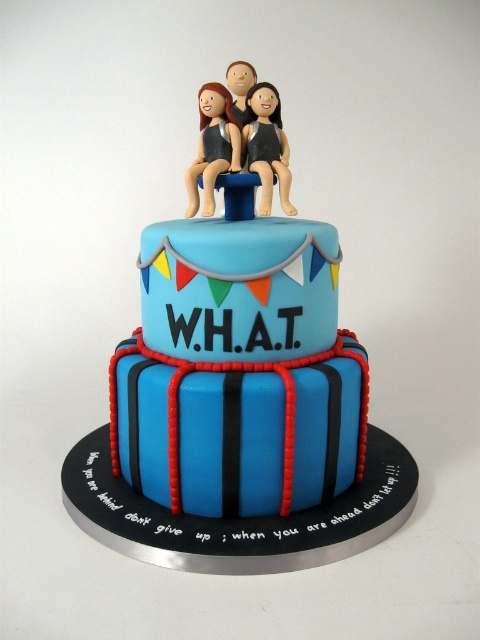
You are a cake decorator who wants to place a new figurine on the cake. The new figurine is 5 inches wide. You see the matte black figurine at center and the matte black figurine at top. Which existing figurine has a wider base to help stabilize the new figurine?

The matte black figurine at center has a wider base than the matte black figurine at top, so placing the new figurine near the matte black figurine at center would provide better stability.

What is the spatial relationship between the two matte black figurines on the cake? Specifically, where is the matte black figurine at center in relation to the matte black figurine at top?

The matte black figurine at center is positioned above the matte black figurine at top.